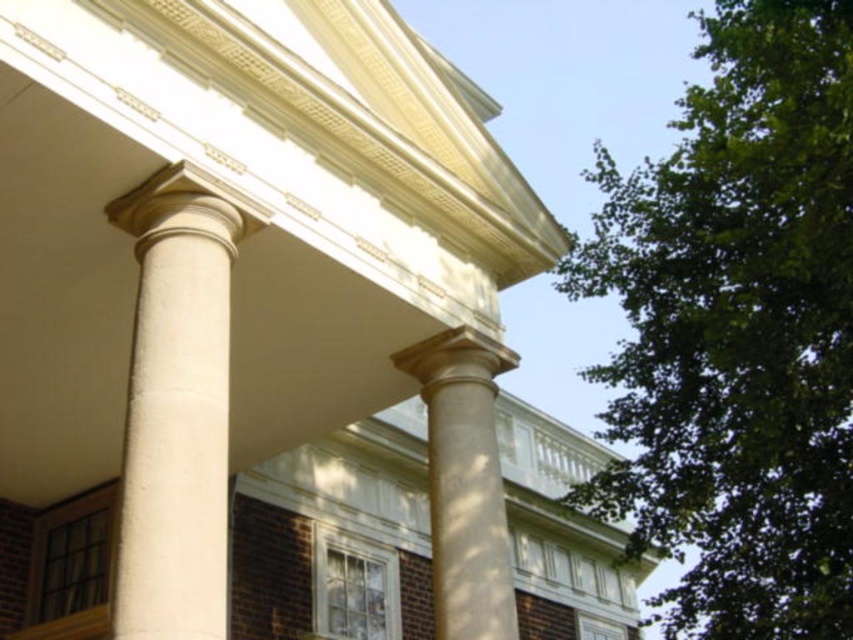
You are an architect designing a new garden layout next to this classical building. The garden must include both the green leafy tree at upper right and the white stone column at left. Based on their sizes, which object should be placed closer to the building to maintain visual balance?

The green leafy tree at upper right might be wider than the white stone column at left, so to maintain visual balance, the tree should be placed farther from the building and the column closer, as larger objects are typically positioned closer to balance smaller ones.